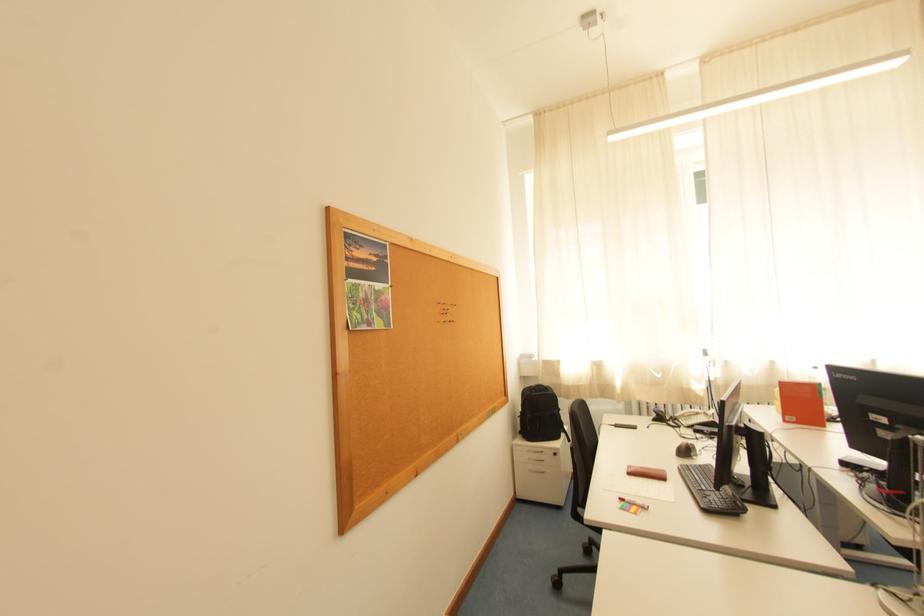
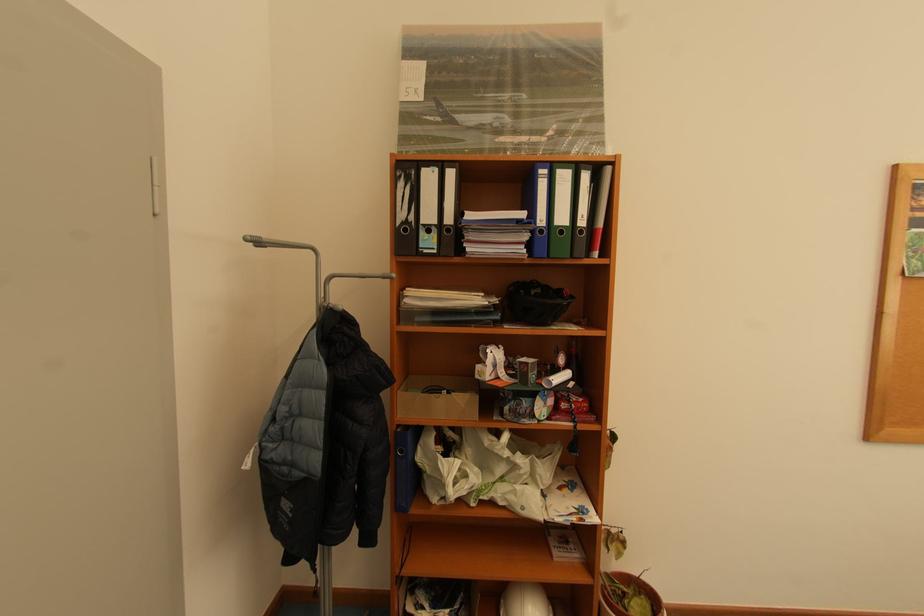
The point at (335, 209) is marked in the first image. Where is the corresponding point in the second image?

(904, 167)